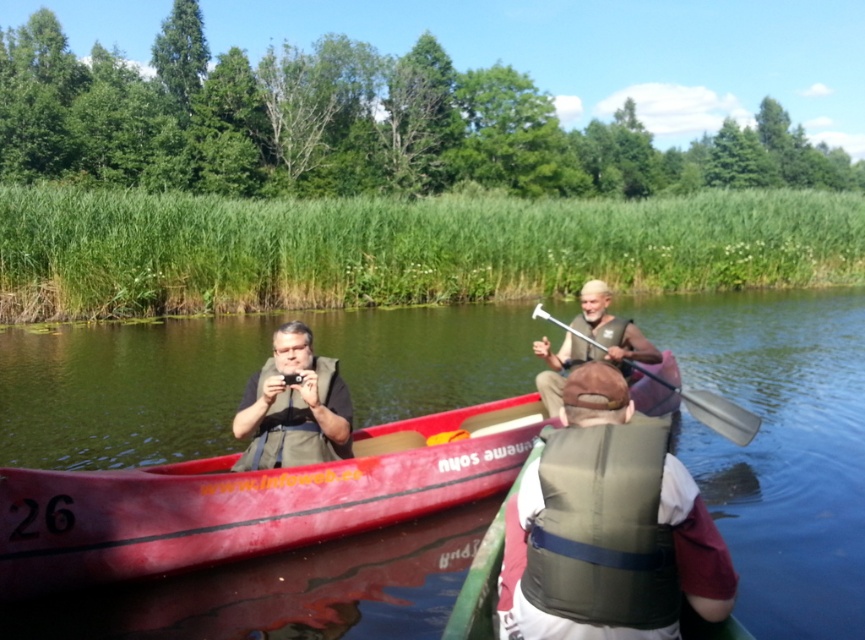
Is green fabric life vest at center wider than matte brown vest at center?

Yes, green fabric life vest at center is wider than matte brown vest at center.

Can you confirm if green fabric life vest at center is bigger than matte brown vest at center?

Indeed, green fabric life vest at center has a larger size compared to matte brown vest at center.

Where is `green fabric life vest at center`? The width and height of the screenshot is (865, 640). green fabric life vest at center is located at coordinates (614, 531).

Is green fabric life vest at center to the left of silver metallic paddle at center from the viewer's perspective?

Yes, green fabric life vest at center is to the left of silver metallic paddle at center.

Is the position of green fabric life vest at center more distant than that of silver metallic paddle at center?

No, it is not.

What do you see at coordinates (614, 531) in the screenshot?
I see `green fabric life vest at center` at bounding box center [614, 531].

Where is `green fabric life vest at center`? This screenshot has width=865, height=640. green fabric life vest at center is located at coordinates tap(614, 531).

Does red plastic canoe at center have a smaller size compared to green fabric life vest at center?

No.

How much distance is there between red plastic canoe at center and green fabric life vest at center?

red plastic canoe at center and green fabric life vest at center are 2.48 meters apart.

Where is `red plastic canoe at center`? Image resolution: width=865 pixels, height=640 pixels. red plastic canoe at center is located at coordinates (248, 499).

At what (x,y) coordinates should I click in order to perform the action: click on red plastic canoe at center. Please return your answer as a coordinate pair (x, y). This screenshot has width=865, height=640. Looking at the image, I should click on (248, 499).